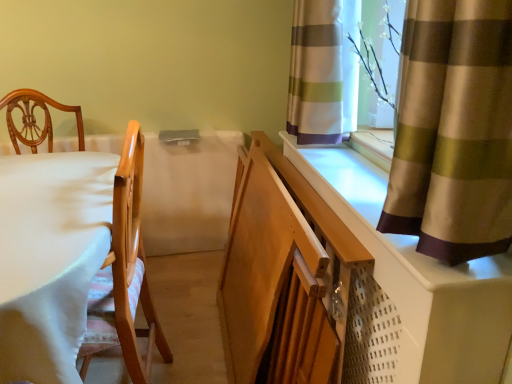
You are a GUI agent. You are given a task and a screenshot of the screen. Output one action in this format:
    pyautogui.click(x=<x>, y=<y>)
    Task: Click on the striped fabric curtain at upper right, the first curtain in the back-to-front sequence
    This screenshot has width=512, height=384.
    Given the screenshot: What is the action you would take?
    pyautogui.click(x=323, y=71)

From the image's perspective, between striped fabric curtain at upper right, the 2th curtain in the front-to-back sequence, and white plastic radiator at right, which one is located above?

striped fabric curtain at upper right, the 2th curtain in the front-to-back sequence.

Is striped fabric curtain at upper right, the first curtain in the back-to-front sequence, shorter than white plastic radiator at right?

Correct, striped fabric curtain at upper right, the first curtain in the back-to-front sequence, is not as tall as white plastic radiator at right.

Is striped fabric curtain at upper right, the 2th curtain in the front-to-back sequence, at the left side of white plastic radiator at right?

Yes, striped fabric curtain at upper right, the 2th curtain in the front-to-back sequence, is to the left of white plastic radiator at right.

Is striped fabric curtain at upper right, the first curtain in the back-to-front sequence, facing towards white plastic radiator at right?

No, striped fabric curtain at upper right, the first curtain in the back-to-front sequence, is not facing towards white plastic radiator at right.

Is white fabric table at left smaller than white plastic radiator at right?

Actually, white fabric table at left might be larger than white plastic radiator at right.

Which object is further away from the camera, white fabric table at left or white plastic radiator at right?

white plastic radiator at right is further from the camera.

From a real-world perspective, is white fabric table at left above or below white plastic radiator at right?

From a real-world perspective, white fabric table at left is physically below white plastic radiator at right.

Is silky brown curtain at upper right, arranged as the second curtain when viewed from the back, not near white fabric table at left?

They are positioned close to each other.

Relative to white fabric table at left, is silky brown curtain at upper right, arranged as the second curtain when viewed from the back, in front or behind?

silky brown curtain at upper right, arranged as the second curtain when viewed from the back, is positioned closer to the viewer than white fabric table at left.

Is silky brown curtain at upper right, which is counted as the 1th curtain, starting from the front, aimed at white fabric table at left?

No, silky brown curtain at upper right, which is counted as the 1th curtain, starting from the front, is not oriented towards white fabric table at left.

From a real-world perspective, does striped fabric curtain at upper right, the 2th curtain in the front-to-back sequence, sit lower than white fabric table at left?

No, from a real-world perspective, striped fabric curtain at upper right, the 2th curtain in the front-to-back sequence, is not beneath white fabric table at left.

From the image's perspective, is striped fabric curtain at upper right, the 2th curtain in the front-to-back sequence, above or below white fabric table at left?

striped fabric curtain at upper right, the 2th curtain in the front-to-back sequence, is above white fabric table at left.

Visually, is striped fabric curtain at upper right, the 2th curtain in the front-to-back sequence, positioned to the left or to the right of white fabric table at left?

striped fabric curtain at upper right, the 2th curtain in the front-to-back sequence, is to the right of white fabric table at left.

Looking at the image, does striped fabric curtain at upper right, the first curtain in the back-to-front sequence, seem bigger or smaller compared to white fabric table at left?

In the image, striped fabric curtain at upper right, the first curtain in the back-to-front sequence, appears to be smaller than white fabric table at left.

From the image's perspective, which one is positioned higher, white plastic radiator at right or white fabric table at left?

white plastic radiator at right, from the image's perspective.

What's the angular difference between white plastic radiator at right and white fabric table at left's facing directions?

178 degrees.

Which is correct: white plastic radiator at right is inside white fabric table at left, or outside of it?

white plastic radiator at right is located beyond the bounds of white fabric table at left.

Can striped fabric curtain at upper right, the first curtain in the back-to-front sequence, be found inside silky brown curtain at upper right, arranged as the second curtain when viewed from the back?

Definitely not — striped fabric curtain at upper right, the first curtain in the back-to-front sequence, is not inside silky brown curtain at upper right, arranged as the second curtain when viewed from the back.

In terms of size, does silky brown curtain at upper right, arranged as the second curtain when viewed from the back, appear bigger or smaller than striped fabric curtain at upper right, the 2th curtain in the front-to-back sequence?

silky brown curtain at upper right, arranged as the second curtain when viewed from the back, is bigger than striped fabric curtain at upper right, the 2th curtain in the front-to-back sequence.

Based on the photo, from the image's perspective, is silky brown curtain at upper right, which is counted as the 1th curtain, starting from the front, located beneath striped fabric curtain at upper right, the 2th curtain in the front-to-back sequence?

Correct, silky brown curtain at upper right, which is counted as the 1th curtain, starting from the front, appears lower than striped fabric curtain at upper right, the 2th curtain in the front-to-back sequence, in the image.

Locate an element on the screen. This screenshot has height=384, width=512. curtain that appears on the right of striped fabric curtain at upper right, the 2th curtain in the front-to-back sequence is located at coordinates (453, 130).

Is silky brown curtain at upper right, arranged as the second curtain when viewed from the back, completely or partially inside striped fabric curtain at upper right, the 2th curtain in the front-to-back sequence?

No, silky brown curtain at upper right, arranged as the second curtain when viewed from the back, is located outside of striped fabric curtain at upper right, the 2th curtain in the front-to-back sequence.

Is striped fabric curtain at upper right, the 2th curtain in the front-to-back sequence, in front of silky brown curtain at upper right, which is counted as the 1th curtain, starting from the front?

No, striped fabric curtain at upper right, the 2th curtain in the front-to-back sequence, is further to the viewer.

Can you confirm if striped fabric curtain at upper right, the 2th curtain in the front-to-back sequence, is shorter than silky brown curtain at upper right, which is counted as the 1th curtain, starting from the front?

No.

Find the location of `the 2nd curtain directly above the white plastic radiator at right (from a real-world perspective)`. the 2nd curtain directly above the white plastic radiator at right (from a real-world perspective) is located at coordinates (323, 71).

This screenshot has height=384, width=512. In order to click on table located in front of the white plastic radiator at right in this screenshot , I will do `click(50, 258)`.

Considering their positions, is white plastic radiator at right positioned further to striped fabric curtain at upper right, the first curtain in the back-to-front sequence, than white fabric table at left?

white fabric table at left.

Which object lies further to the anchor point white fabric table at left, white plastic radiator at right or striped fabric curtain at upper right, the 2th curtain in the front-to-back sequence?

striped fabric curtain at upper right, the 2th curtain in the front-to-back sequence, is further to white fabric table at left.

Estimate the real-world distances between objects in this image. Which object is closer to striped fabric curtain at upper right, the first curtain in the back-to-front sequence, white fabric table at left or white plastic radiator at right?

white plastic radiator at right lies closer to striped fabric curtain at upper right, the first curtain in the back-to-front sequence, than the other object.

Looking at this image, when comparing their distances from silky brown curtain at upper right, arranged as the second curtain when viewed from the back, does striped fabric curtain at upper right, the 2th curtain in the front-to-back sequence, or white plastic radiator at right seem further?

striped fabric curtain at upper right, the 2th curtain in the front-to-back sequence, is positioned further to the anchor silky brown curtain at upper right, arranged as the second curtain when viewed from the back.

Consider the image. Looking at the image, which one is located closer to silky brown curtain at upper right, arranged as the second curtain when viewed from the back, white plastic radiator at right or striped fabric curtain at upper right, the first curtain in the back-to-front sequence?

white plastic radiator at right lies closer to silky brown curtain at upper right, arranged as the second curtain when viewed from the back, than the other object.

Based on their spatial positions, is silky brown curtain at upper right, arranged as the second curtain when viewed from the back, or white plastic radiator at right closer to white fabric table at left?

white plastic radiator at right lies closer to white fabric table at left than the other object.

Looking at the image, which one is located closer to white plastic radiator at right, striped fabric curtain at upper right, the 2th curtain in the front-to-back sequence, or silky brown curtain at upper right, arranged as the second curtain when viewed from the back?

silky brown curtain at upper right, arranged as the second curtain when viewed from the back.

From the picture: When comparing their distances from white plastic radiator at right, does striped fabric curtain at upper right, the 2th curtain in the front-to-back sequence, or white fabric table at left seem closer?

striped fabric curtain at upper right, the 2th curtain in the front-to-back sequence.

Locate an element on the screen. The height and width of the screenshot is (384, 512). curtain that lies between striped fabric curtain at upper right, the first curtain in the back-to-front sequence, and white plastic radiator at right from top to bottom is located at coordinates (453, 130).

Image resolution: width=512 pixels, height=384 pixels. I want to click on curtain between white fabric table at left and silky brown curtain at upper right, which is counted as the 1th curtain, starting from the front, so click(x=323, y=71).

Find the location of a particular element. The width and height of the screenshot is (512, 384). cabinetry situated between white fabric table at left and silky brown curtain at upper right, which is counted as the 1th curtain, starting from the front, from left to right is located at coordinates (400, 269).

The height and width of the screenshot is (384, 512). I want to click on curtain located between white fabric table at left and white plastic radiator at right in the left-right direction, so click(x=323, y=71).